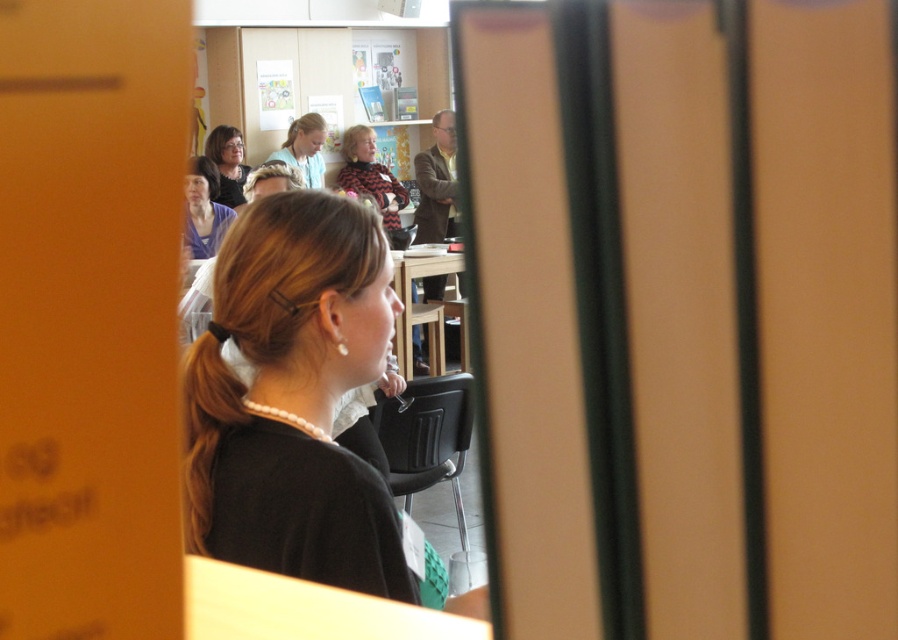
You are organizing a photo shoot and need to adjust the distance between the matte blue shirt at upper center and the matte black sweater at upper left to exactly 60 centimeters. Currently, they are 50.54 centimeters apart. How much distance do you need to add between them?

The current distance between the matte blue shirt at upper center and the matte black sweater at upper left is 50.54 centimeters. To reach the desired 60 centimeters, you need to add 9.46 centimeters between them.

You are organizing a photo shoot and need to arrange two outfits in the scene. The outfits are the black textured sweater at center and the matte purple blouse at upper left. Based on their positions, which outfit should you place higher up in the final photo to maintain visual balance?

The black textured sweater at center should be placed higher up in the final photo because it is taller than the matte purple blouse at upper left, so elevating it would help balance the composition.

You are an event planner arranging seating for a workshop. You need to place a name tag on the table in front of the black textured sweater at center and the matte purple blouse at upper left. Which name tag should be placed to the left of the other?

The matte purple blouse at upper left should have its name tag placed to the left because the black textured sweater at center is positioned to the right of the matte purple blouse at upper left.